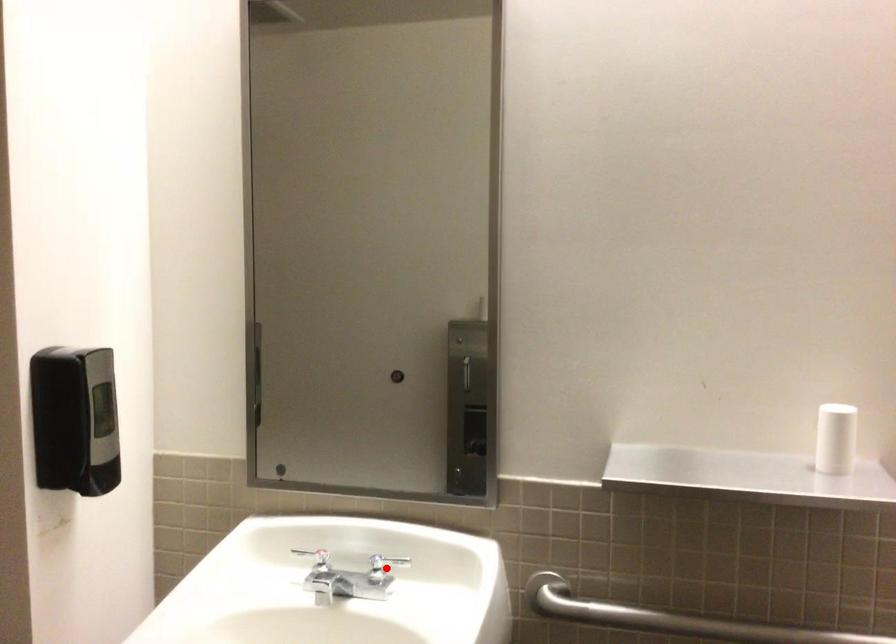
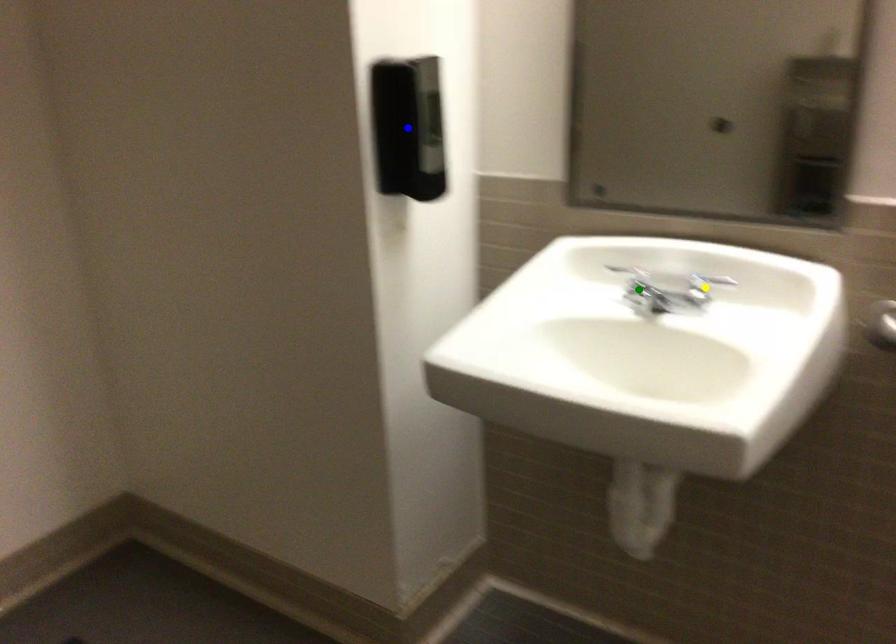
Question: I am providing you with two images of the same scene from different viewpoints. A red point is marked on the first image. You are given multiple points on the second image. Which spot in image 2 lines up with the point in image 1?

Choices:
 (A) blue point
 (B) green point
 (C) yellow point

Answer: (C)